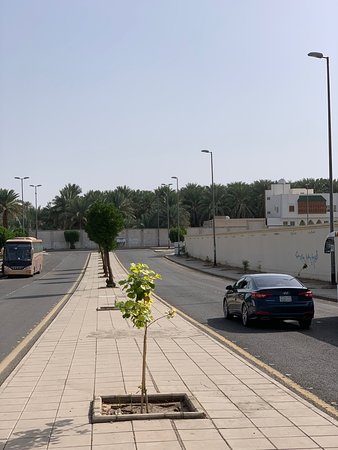
The width and height of the screenshot is (338, 450). What are the coordinates of `windows` in the screenshot? It's located at (272, 280), (247, 283), (238, 283), (17, 255), (37, 245).